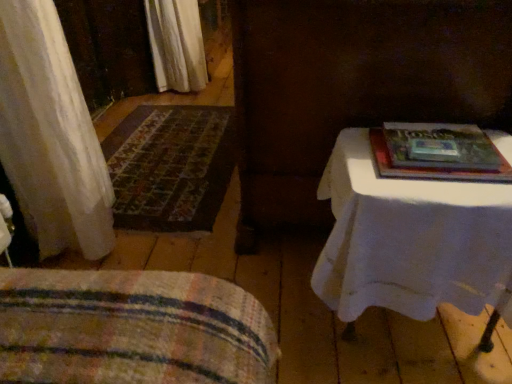
Question: Considering the positions of point (82, 274) and point (138, 119), is point (82, 274) closer or farther from the camera than point (138, 119)?

Choices:
 (A) farther
 (B) closer

Answer: (B)

Question: Considering the positions of striped fabric blanket at lower left and carpeted mat at left in the image, is striped fabric blanket at lower left wider or thinner than carpeted mat at left?

Choices:
 (A) wide
 (B) thin

Answer: (B)

Question: Estimate the real-world distances between objects in this image. Which object is farther from the white cloth-covered table at right?

Choices:
 (A) hardcover book at upper right
 (B) striped fabric blanket at lower left
 (C) carpeted mat at left

Answer: (C)

Question: Considering the real-world distances, which object is closest to the carpeted mat at left?

Choices:
 (A) hardcover book at upper right
 (B) striped fabric blanket at lower left
 (C) white cloth-covered table at right

Answer: (C)